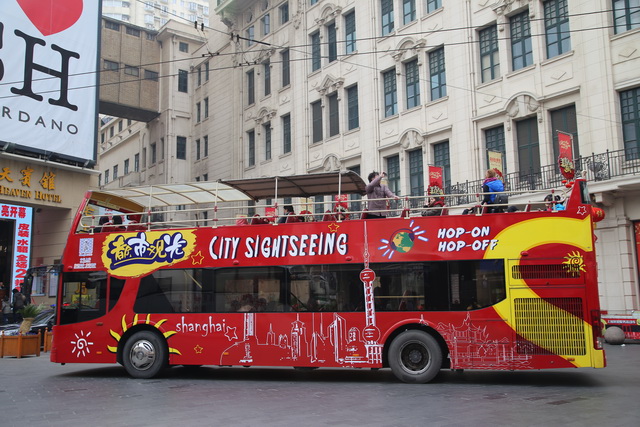
Identify the location of safety railing. click(x=209, y=205).